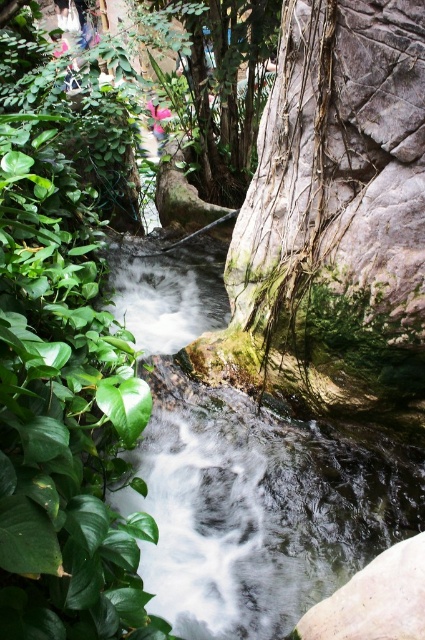
Does green leafy plant at left appear on the left side of white frothy water at center?

In fact, green leafy plant at left is to the right of white frothy water at center.

Is green leafy plant at left further to the viewer compared to white frothy water at center?

No.

The image size is (425, 640). I want to click on green leafy plant at left, so click(x=61, y=376).

Image resolution: width=425 pixels, height=640 pixels. I want to click on green leafy plant at left, so click(61, 376).